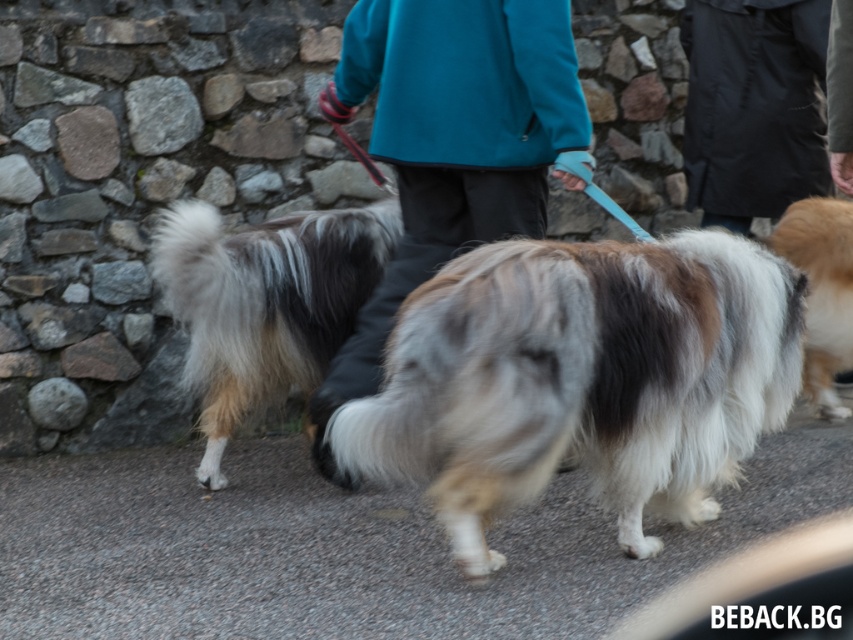
Does point (271, 378) come behind point (780, 188)?

No, (271, 378) is in front of (780, 188).

Which is in front, point (248, 387) or point (822, 36)?

Point (248, 387) is more forward.

Does point (274, 273) come farther from viewer compared to point (795, 65)?

No, it is not.

You are a GUI agent. You are given a task and a screenshot of the screen. Output one action in this format:
    pyautogui.click(x=<x>, y=<y>)
    Task: Click on the fuzzy white dog at center
    This screenshot has width=853, height=640.
    Given the screenshot: What is the action you would take?
    pyautogui.click(x=264, y=304)

Who is more forward, (613, 292) or (819, 273)?

Positioned in front is point (613, 292).

Is fluffy multi-colored dog at center above fluffy beige dog at right?

Actually, fluffy multi-colored dog at center is below fluffy beige dog at right.

Which is in front, point (685, 314) or point (849, 272)?

Point (685, 314) is more forward.

Locate an element on the screen. This screenshot has height=640, width=853. fluffy multi-colored dog at center is located at coordinates (579, 380).

Is teal fleece jacket at center taller than black waterproof jacket at upper right?

Correct, teal fleece jacket at center is much taller as black waterproof jacket at upper right.

Consider the image. Does teal fleece jacket at center come behind black waterproof jacket at upper right?

That is False.

At what (x,y) coordinates should I click in order to perform the action: click on teal fleece jacket at center. Please return your answer as a coordinate pair (x, y). Looking at the image, I should click on 451,145.